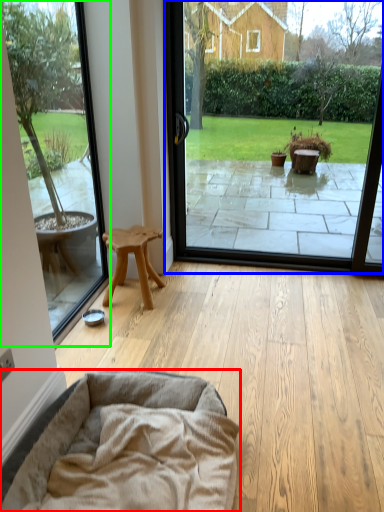
Question: Which object is positioned farthest from dog bed (highlighted by a red box)? Select from window screen (highlighted by a blue box) and window screen (highlighted by a green box).

Choices:
 (A) window screen
 (B) window screen

Answer: (A)